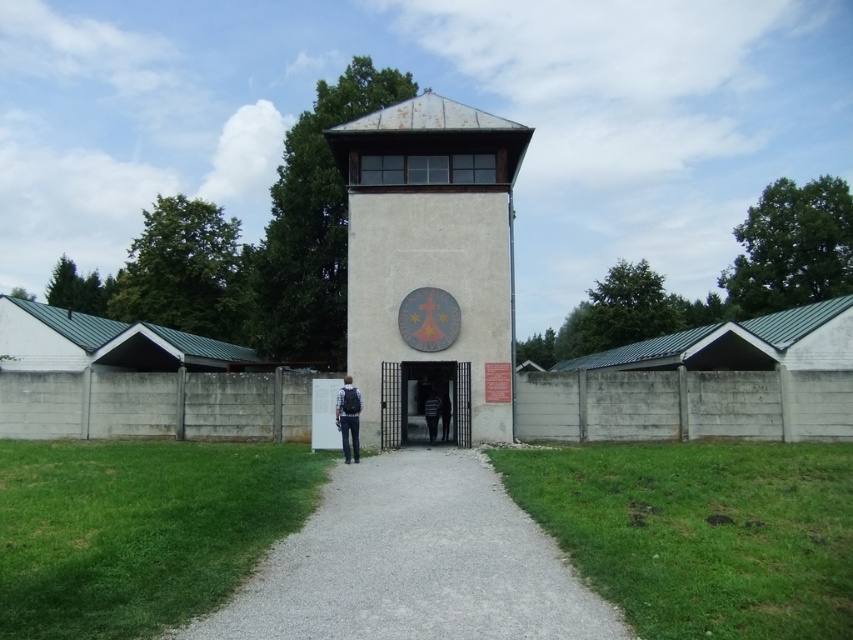
The image size is (853, 640). In order to click on denim jacket at center in this screenshot , I will do pyautogui.click(x=347, y=417).

Who is higher up, denim jacket at center or striped fabric jacket at center?

denim jacket at center is above.

At what (x,y) coordinates should I click in order to perform the action: click on denim jacket at center. Please return your answer as a coordinate pair (x, y). Looking at the image, I should click on coord(347,417).

Who is more forward, (390, 211) or (399, 544)?

Point (399, 544)

Can you confirm if beige concrete tower at center is taller than gray gravel path at center?

Yes.

Who is more distant from viewer, (376,321) or (431,532)?

Positioned behind is point (376,321).

I want to click on beige concrete tower at center, so click(430, 262).

Which is behind, point (425, 372) or point (433, 426)?

The point (425, 372) is more distant.

Identify the location of smooth concrete gate at center. (436, 401).

Measure the distance between point (403,419) and camera.

16.28 meters

The width and height of the screenshot is (853, 640). In order to click on smooth concrete gate at center in this screenshot , I will do `click(436, 401)`.